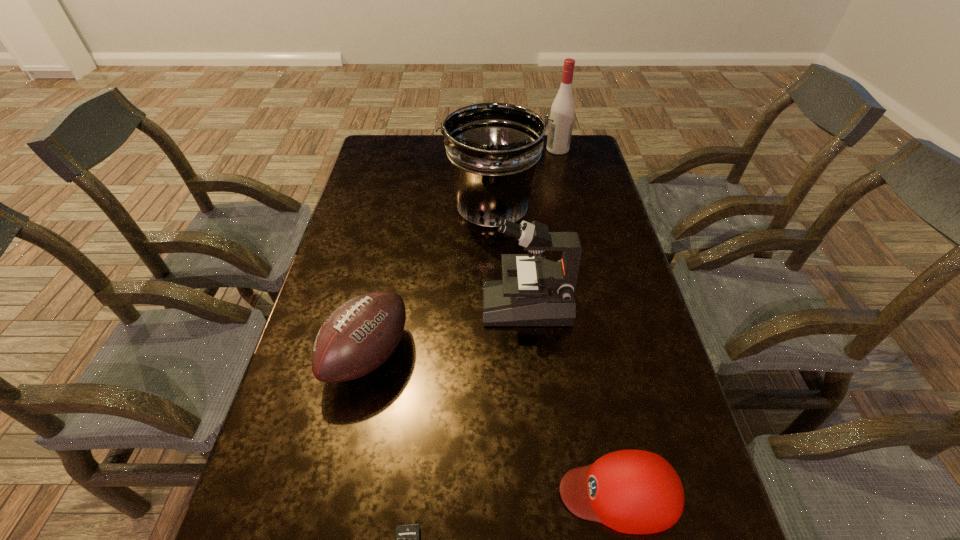
You are a GUI agent. You are given a task and a screenshot of the screen. Output one action in this format:
    pyautogui.click(x=<x>, y=<y>)
    Task: Click on the farthest object
    
    Given the screenshot: What is the action you would take?
    pyautogui.click(x=562, y=112)

At what (x,y) coordinates should I click in order to perform the action: click on bucket. Please return your answer as a coordinate pair (x, y). The width and height of the screenshot is (960, 540). Looking at the image, I should click on (493, 149).

Locate an element on the screen. This screenshot has width=960, height=540. microscope is located at coordinates (543, 293).

Identify the location of football (American). (361, 334).

In order to click on the leftmost object in this screenshot , I will do [361, 334].

Locate an element on the screen. The width and height of the screenshot is (960, 540). the second shortest object is located at coordinates (630, 491).

Where is `free space located on the label of the alcohol`? Image resolution: width=960 pixels, height=540 pixels. free space located on the label of the alcohol is located at coordinates (462, 149).

Find the location of a particular element. vacant region located on the label of the alcohol is located at coordinates (513, 149).

Locate an element on the screen. free space located 0.220m on the label of the alcohol is located at coordinates (490, 149).

This screenshot has width=960, height=540. Find the location of `vacant area situated on the back of the bucket`. vacant area situated on the back of the bucket is located at coordinates (491, 136).